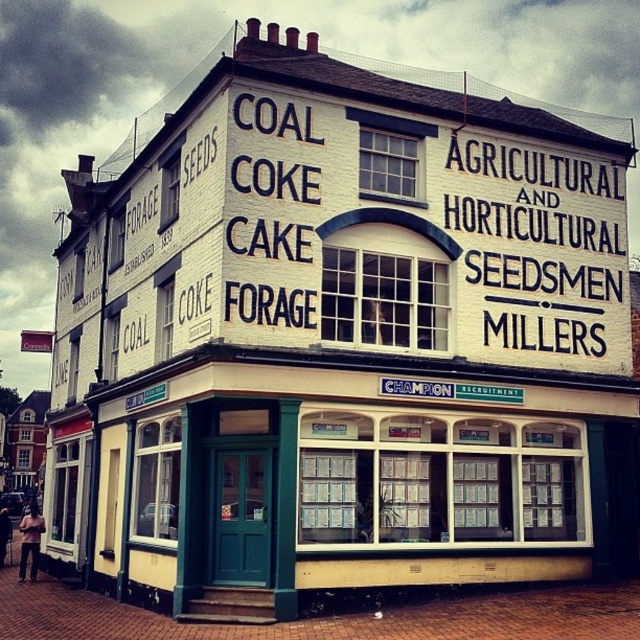
Question: Does black painted sign at upper right appear on the left side of black painted sign at center?

Choices:
 (A) no
 (B) yes

Answer: (A)

Question: Observing the image, what is the correct spatial positioning of black painted sign at upper right in reference to black painted sign at center?

Choices:
 (A) right
 (B) left

Answer: (A)

Question: Can you confirm if black painted sign at upper right is wider than black painted sign at center?

Choices:
 (A) no
 (B) yes

Answer: (B)

Question: Which of the following is the closest to the observer?

Choices:
 (A) black painted sign at center
 (B) black painted sign at upper right
 (C) matte green door at center

Answer: (C)

Question: Which object appears farthest from the camera in this image?

Choices:
 (A) matte green door at center
 (B) black painted sign at upper right

Answer: (B)

Question: Based on their relative distances, which object is farther from the black painted sign at upper right?

Choices:
 (A) black painted sign at center
 (B) matte green door at center

Answer: (A)